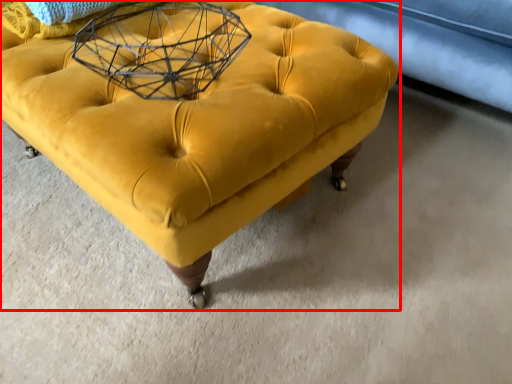
Question: Where is furniture (annotated by the red box) located in relation to round table in the image?

Choices:
 (A) right
 (B) left

Answer: (A)